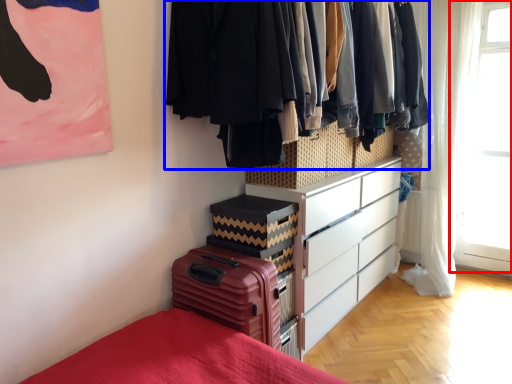
Question: Which object is closer to the camera taking this photo, window screen (highlighted by a red box) or closet (highlighted by a blue box)?

Choices:
 (A) window screen
 (B) closet

Answer: (B)